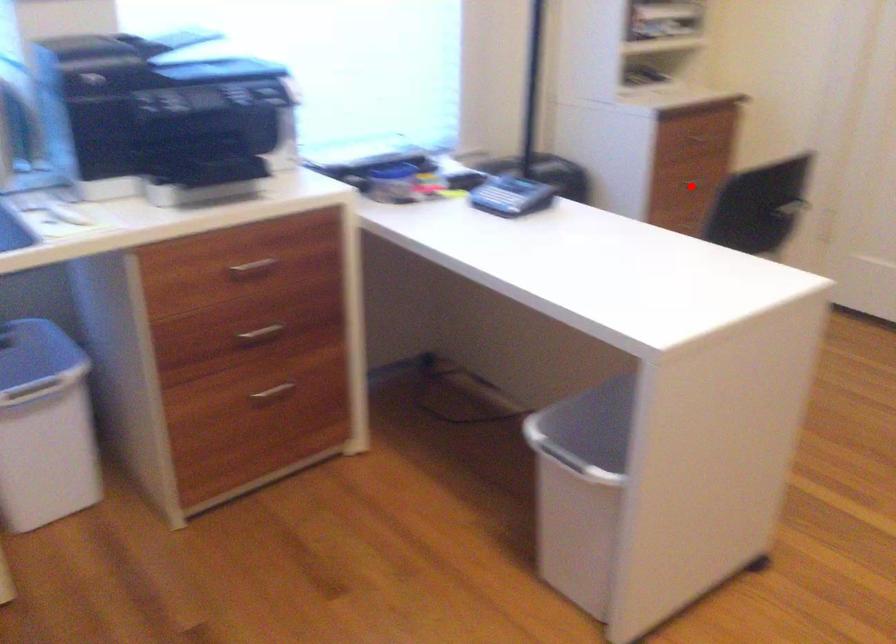
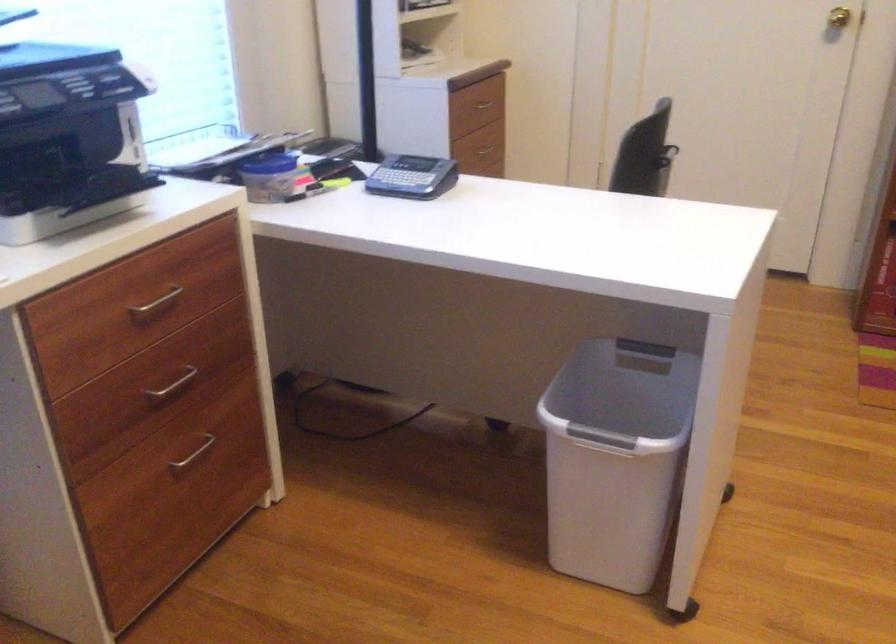
In the second image, find the point that corresponds to the highlighted location in the first image.

(486, 149)